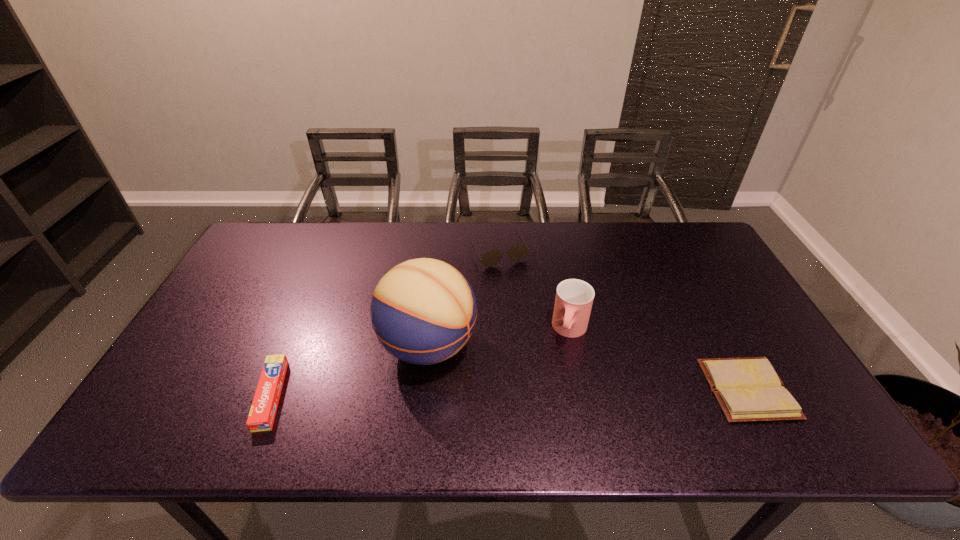
Locate an element on the screen. This screenshot has width=960, height=540. toothpaste is located at coordinates (263, 410).

Find the location of a particular element. Image resolution: width=960 pixels, height=540 pixels. the leftmost object is located at coordinates pyautogui.click(x=263, y=410).

The height and width of the screenshot is (540, 960). What are the coordinates of `the shortest object` in the screenshot? It's located at (748, 389).

The width and height of the screenshot is (960, 540). Find the location of `the rightmost object`. the rightmost object is located at coordinates (748, 389).

In order to click on sunglasses in this screenshot , I will do `click(518, 252)`.

Where is `the farthest object`? the farthest object is located at coordinates (518, 252).

Where is `basketball`? The width and height of the screenshot is (960, 540). basketball is located at coordinates (423, 311).

I want to click on the second tallest object, so click(574, 298).

Where is `cup`? The width and height of the screenshot is (960, 540). cup is located at coordinates (574, 298).

You are a GUI agent. You are given a task and a screenshot of the screen. Output one action in this format:
    pyautogui.click(x=<x>, y=<y>)
    Task: Click on the vacant space located 0.130m on the left of the leftmost object
    This screenshot has height=540, width=960.
    Given the screenshot: What is the action you would take?
    pyautogui.click(x=203, y=395)